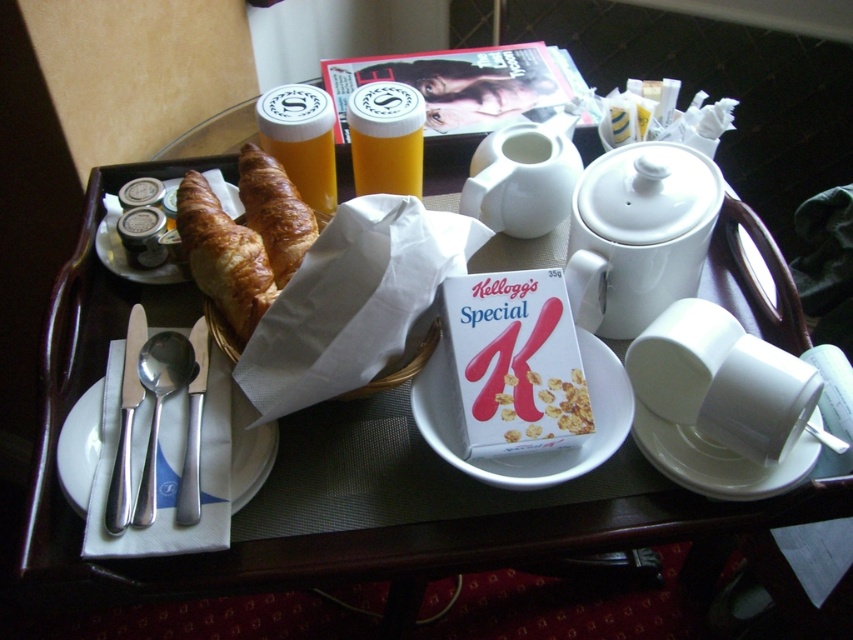
Can you confirm if translucent glass juice at center is bigger than golden brown flaky croissant at center?

Incorrect, translucent glass juice at center is not larger than golden brown flaky croissant at center.

Is translucent glass juice at center smaller than golden brown flaky croissant at center?

Yes, translucent glass juice at center is smaller than golden brown flaky croissant at center.

At what (x,y) coordinates should I click in order to perform the action: click on translucent glass juice at center. Please return your answer as a coordinate pair (x, y). The image size is (853, 640). Looking at the image, I should click on (300, 140).

Based on the photo, who is positioned more to the right, white ceramic teapot at upper right or white cardboard cereal box at center?

From the viewer's perspective, white ceramic teapot at upper right appears more on the right side.

Which is more to the left, white ceramic teapot at upper right or white cardboard cereal box at center?

white cardboard cereal box at center

Between point (635, 160) and point (570, 426), which one is positioned in front?

Point (570, 426)

The height and width of the screenshot is (640, 853). Identify the location of white ceramic teapot at upper right. (637, 234).

Who is more forward, (x=529, y=129) or (x=498, y=396)?

Point (x=498, y=396) is more forward.

Who is positioned more to the right, white ceramic teapot at center or white cardboard cereal box at center?

white ceramic teapot at center

Is point (498, 177) farther from viewer compared to point (556, 390)?

That is True.

Find the location of a particular element. white ceramic teapot at center is located at coordinates pos(523,177).